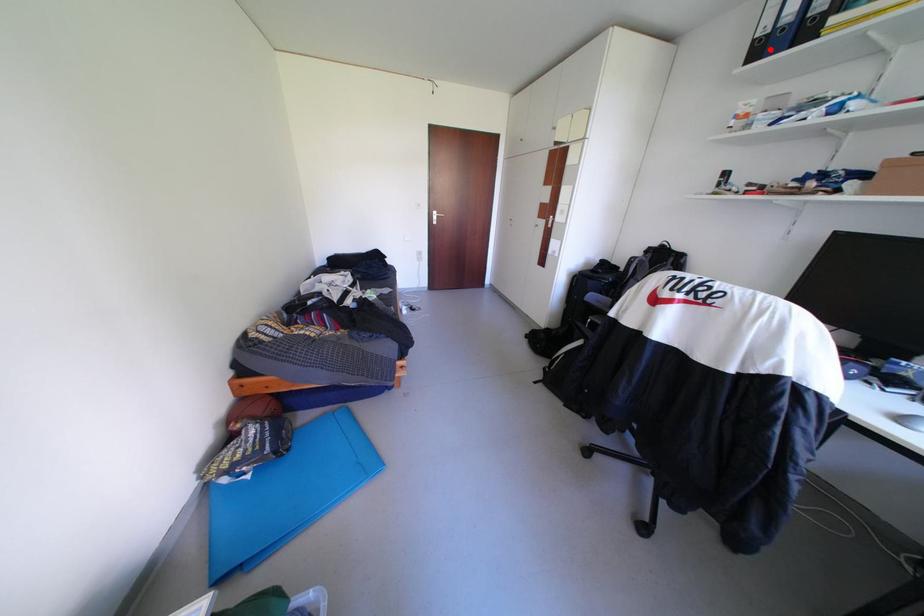
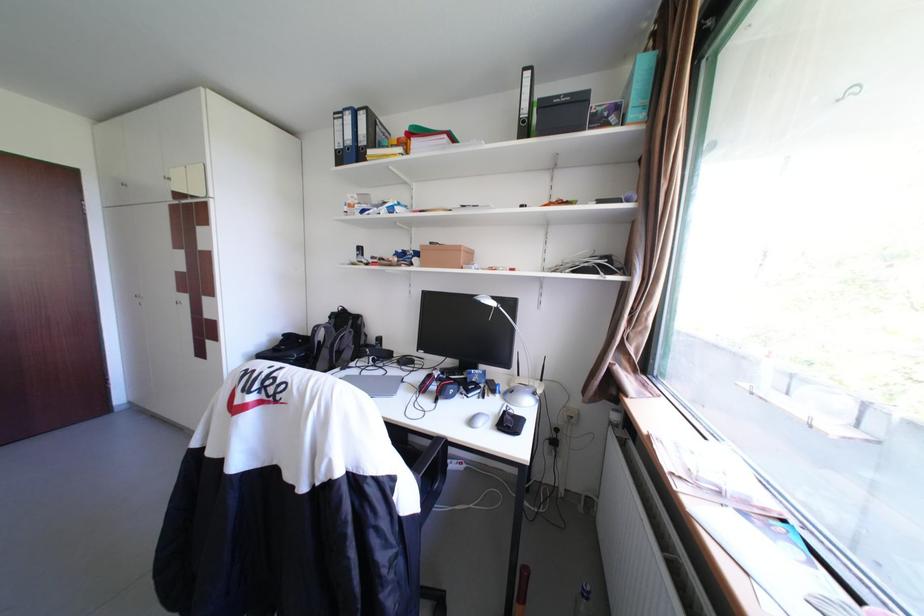
Locate, in the second image, the point that corresponds to the highlighted location in the first image.

(351, 158)